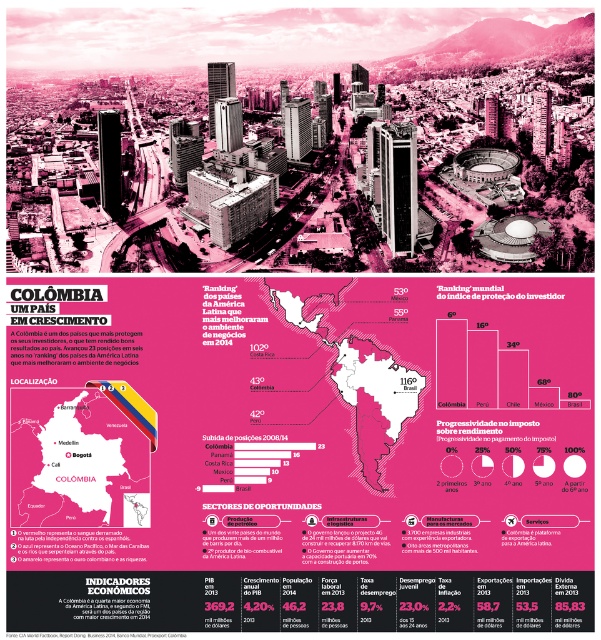
Question: Does matte black map at center have a smaller size compared to pink paper map at center?

Choices:
 (A) no
 (B) yes

Answer: (B)

Question: Does matte black map at center lie in front of pink paper map at center?

Choices:
 (A) yes
 (B) no

Answer: (A)

Question: Which object appears closest to the camera in this image?

Choices:
 (A) pink paper map at center
 (B) matte black map at center

Answer: (B)

Question: Does matte black map at center have a smaller size compared to pink paper map at center?

Choices:
 (A) no
 (B) yes

Answer: (B)

Question: Which of the following is the closest to the observer?

Choices:
 (A) pink paper map at center
 (B) matte black map at center

Answer: (B)